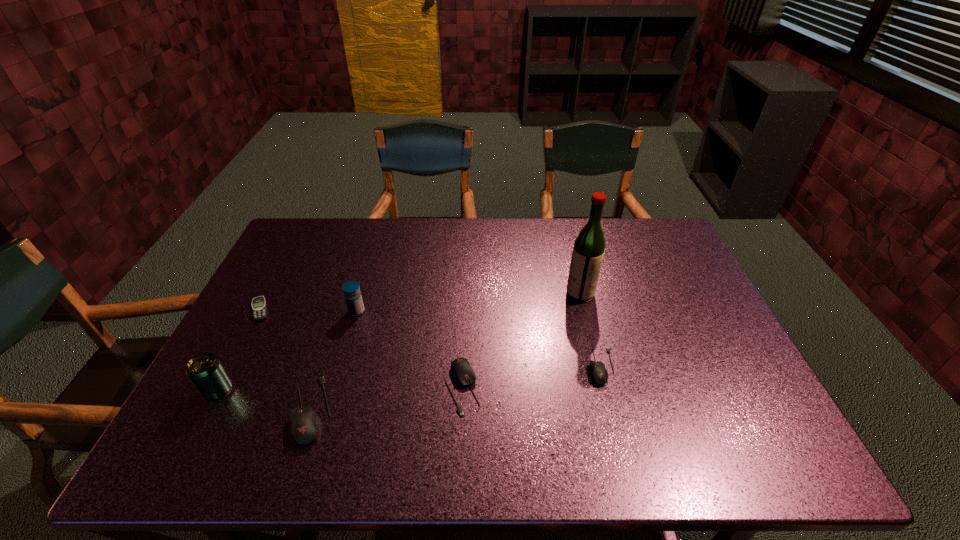
Where is `the leftmost mouse`? Image resolution: width=960 pixels, height=540 pixels. the leftmost mouse is located at coordinates (305, 425).

Where is `the third shortest object`? the third shortest object is located at coordinates (462, 373).

I want to click on the second mouse from right to left, so click(x=462, y=373).

The width and height of the screenshot is (960, 540). I want to click on the second shortest object, so click(599, 374).

Identify the location of the rightmost mouse. This screenshot has width=960, height=540. (599, 374).

Where is `the tallest object`? the tallest object is located at coordinates (589, 246).

Find the location of a particular element. The image size is (960, 540). medicine is located at coordinates (351, 289).

You are a GUI agent. You are given a task and a screenshot of the screen. Output one action in this format:
    pyautogui.click(x=<x>, y=<y>)
    Task: Click on the beer can
    
    Given the screenshot: What is the action you would take?
    pyautogui.click(x=206, y=372)

The height and width of the screenshot is (540, 960). In order to click on beeper in this screenshot , I will do `click(258, 305)`.

In order to click on vacant space located 0.200m on the back of the leftmost mouse in this screenshot , I will do `click(341, 319)`.